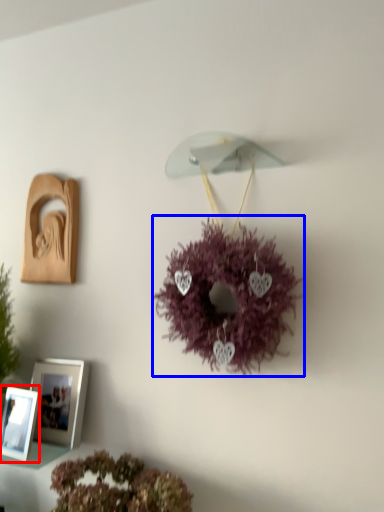
Question: Which of the following is the closest to the observer, picture frame (highlighted by a red box) or flower (highlighted by a blue box)?

Choices:
 (A) picture frame
 (B) flower

Answer: (B)